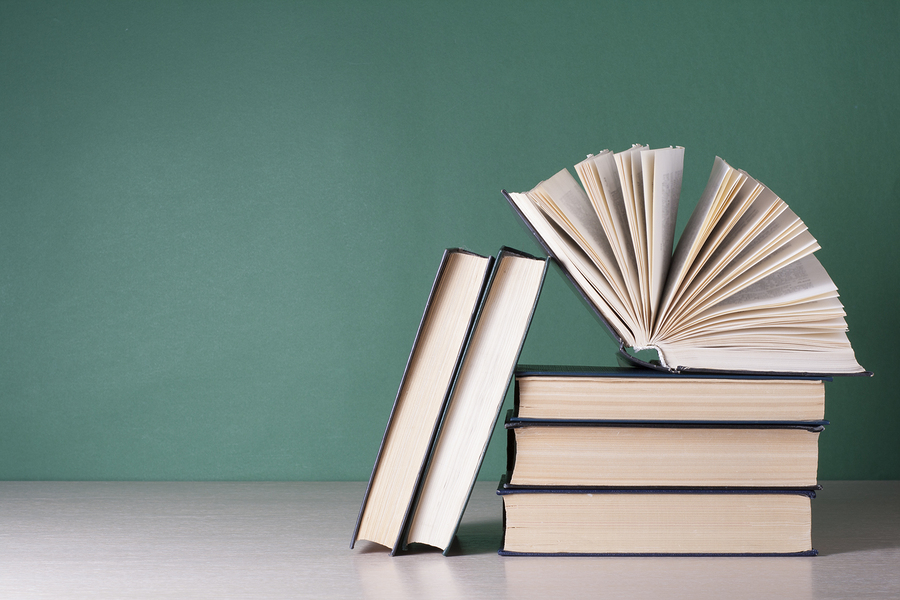
Locate an element on the screen. Image resolution: width=900 pixels, height=600 pixels. books is located at coordinates (452, 306), (495, 342), (688, 327), (673, 403), (671, 465), (669, 523).